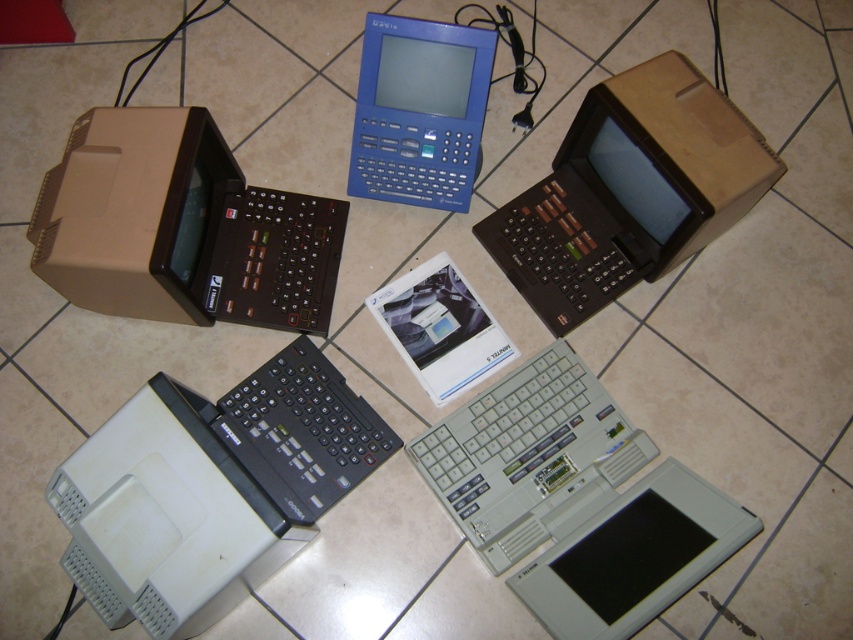
Question: Estimate the real-world distances between objects in this image. Which object is closer to the gray plastic laptop at lower right?

Choices:
 (A) brown matte/soft plastic computer at upper left
 (B) white plastic computer at bottom left
 (C) gray plastic laptop at center
 (D) brown cardboard box at upper right

Answer: (C)

Question: Considering the real-world distances, which object is farthest from the brown cardboard box at upper right?

Choices:
 (A) blue plastic handheld at upper center
 (B) gray plastic laptop at lower right
 (C) brown matte/soft plastic computer at upper left

Answer: (C)

Question: Which point is farther to the camera?

Choices:
 (A) blue plastic handheld at upper center
 (B) white plastic computer at bottom left
 (C) gray plastic laptop at lower right
 (D) gray plastic laptop at center

Answer: (A)

Question: Observing the image, what is the correct spatial positioning of gray plastic laptop at center in reference to brown cardboard box at upper right?

Choices:
 (A) above
 (B) below

Answer: (B)

Question: Does white plastic computer at bottom left have a smaller size compared to gray plastic laptop at center?

Choices:
 (A) yes
 (B) no

Answer: (B)

Question: Is brown matte/soft plastic computer at upper left to the left of brown cardboard box at upper right from the viewer's perspective?

Choices:
 (A) no
 (B) yes

Answer: (B)